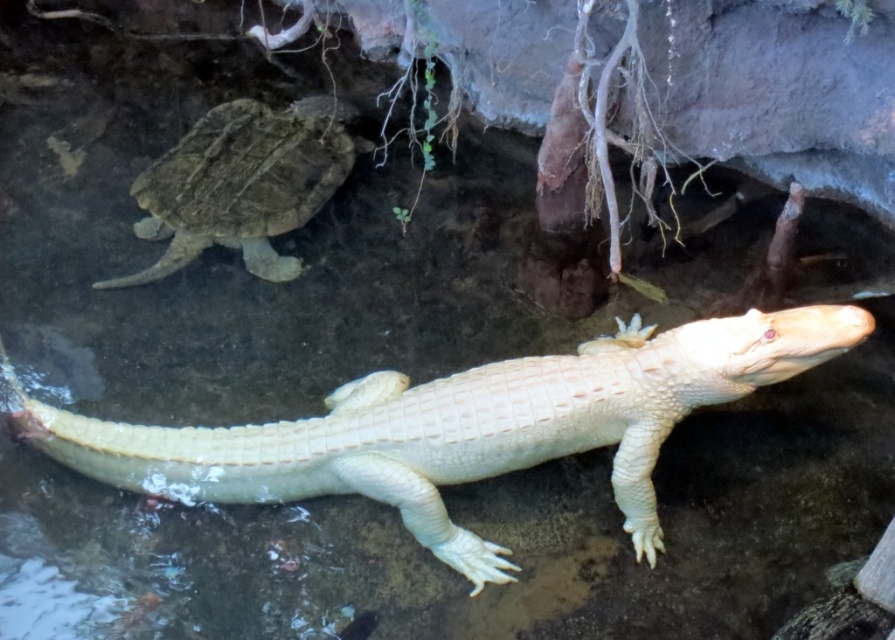
Question: Among these points, which one is farthest from the camera?

Choices:
 (A) (484, 406)
 (B) (356, 141)

Answer: (B)

Question: Is white scaly crocodile at center in front of leathery brown tortoise at upper left?

Choices:
 (A) yes
 (B) no

Answer: (A)

Question: Among these objects, which one is farthest from the camera?

Choices:
 (A) leathery brown tortoise at upper left
 (B) white scaly crocodile at center

Answer: (A)

Question: Is white scaly crocodile at center to the right of leathery brown tortoise at upper left from the viewer's perspective?

Choices:
 (A) yes
 (B) no

Answer: (A)

Question: Where is white scaly crocodile at center located in relation to leathery brown tortoise at upper left in the image?

Choices:
 (A) left
 (B) right

Answer: (B)

Question: Which of the following is the farthest from the observer?

Choices:
 (A) (331, 120)
 (B) (665, 371)

Answer: (A)